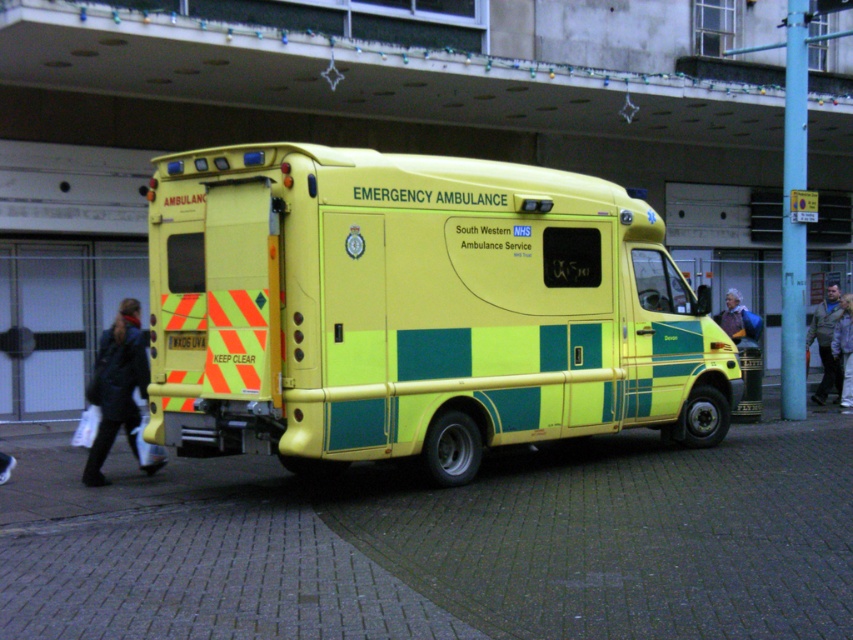
You are a paramedic arriving at the scene and see the light gray fabric jacket at lower right and the blue fabric jacket at center. Which jacket is taller?

The light gray fabric jacket at lower right is much taller than the blue fabric jacket at center.

You are standing at the point labeled point (439, 451). You want to take a photo of the ambulance from a distance of 10 meters. Can you move forward or backward to achieve this?

The point labeled point (439, 451) is currently 9.47 meters away from the camera. To reach a distance of 10 meters, you should move backward slightly.